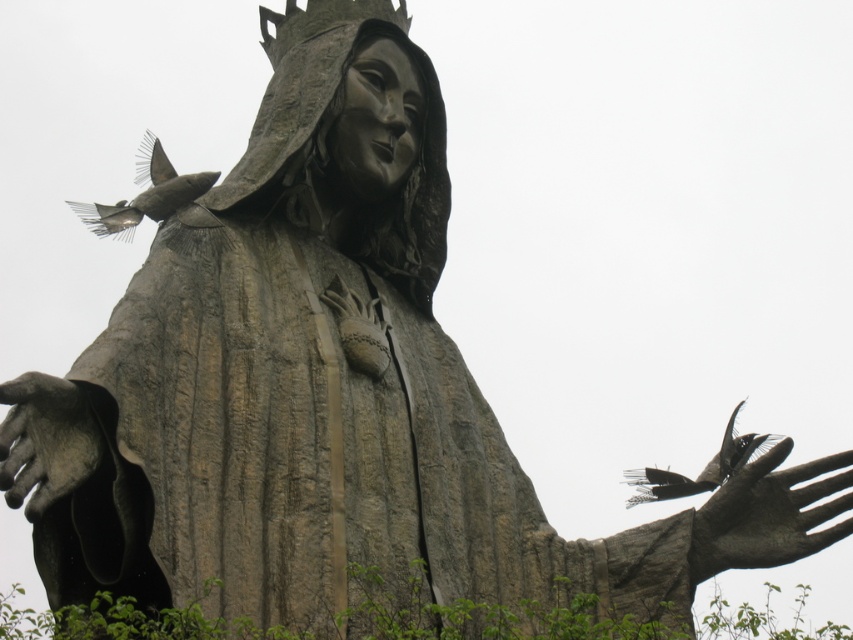
Between point (6, 428) and point (759, 452), which one is positioned in front?

Positioned in front is point (6, 428).

Can you confirm if stone textured hand at lower left is positioned above dark gray feathers at right?

Yes.

The image size is (853, 640). What do you see at coordinates (45, 440) in the screenshot?
I see `stone textured hand at lower left` at bounding box center [45, 440].

Image resolution: width=853 pixels, height=640 pixels. Find the location of `stone textured hand at lower left`. stone textured hand at lower left is located at coordinates (45, 440).

Is point (44, 486) less distant than point (155, 163)?

Yes.

Who is lower down, stone textured hand at lower left or gray matte bird at upper left?

stone textured hand at lower left is below.

Is point (6, 464) positioned before point (102, 234)?

That is True.

Locate an element on the screen. Image resolution: width=853 pixels, height=640 pixels. stone textured hand at lower left is located at coordinates (45, 440).

Is point (727, 538) in front of point (637, 490)?

Yes, point (727, 538) is in front of point (637, 490).

Based on the photo, can you confirm if gray stone hand at right is smaller than dark gray feathers at right?

Indeed, gray stone hand at right has a smaller size compared to dark gray feathers at right.

Identify the location of gray stone hand at right. The image size is (853, 640). (769, 515).